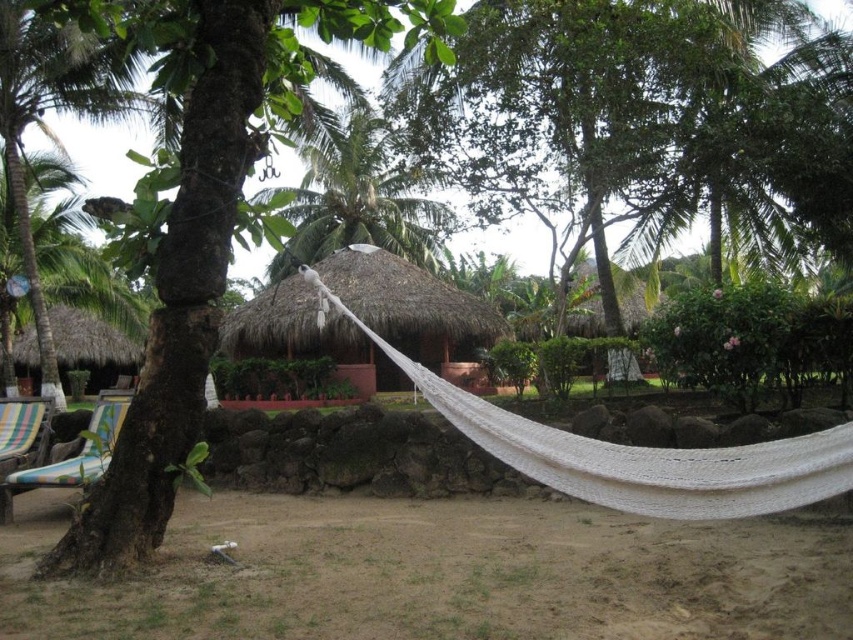
Based on the photo, is thatched straw hut at center thinner than thatched straw hut at left?

No, thatched straw hut at center is not thinner than thatched straw hut at left.

Where is `thatched straw hut at center`? The image size is (853, 640). thatched straw hut at center is located at coordinates (415, 308).

Between green leafy palm tree at left and striped fabric beach chair at lower left, which one has more height?

Standing taller between the two is striped fabric beach chair at lower left.

Does green leafy palm tree at left have a larger size compared to striped fabric beach chair at lower left?

Incorrect, green leafy palm tree at left is not larger than striped fabric beach chair at lower left.

At what (x,y) coordinates should I click in order to perform the action: click on green leafy palm tree at left. Please return your answer as a coordinate pair (x, y). This screenshot has width=853, height=640. Looking at the image, I should click on 45,125.

Who is more forward, (x=97, y=346) or (x=599, y=310)?

Point (x=599, y=310)

Is thatched straw hut at left smaller than thatched roof hut at upper center?

Yes, thatched straw hut at left is smaller than thatched roof hut at upper center.

Is point (91, 381) positioned behind point (643, 316)?

Yes, it is behind point (643, 316).

The height and width of the screenshot is (640, 853). Find the location of `thatched straw hut at left`. thatched straw hut at left is located at coordinates (93, 346).